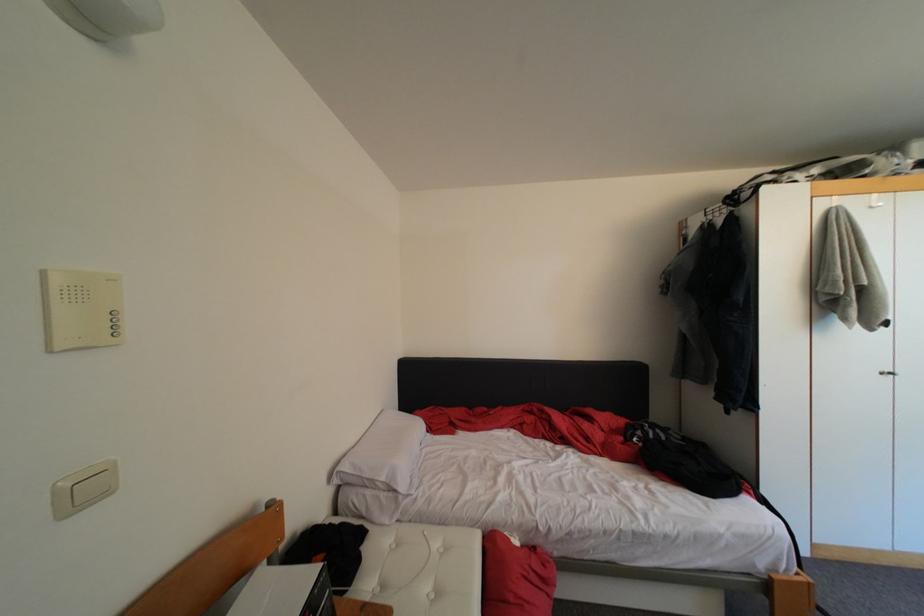
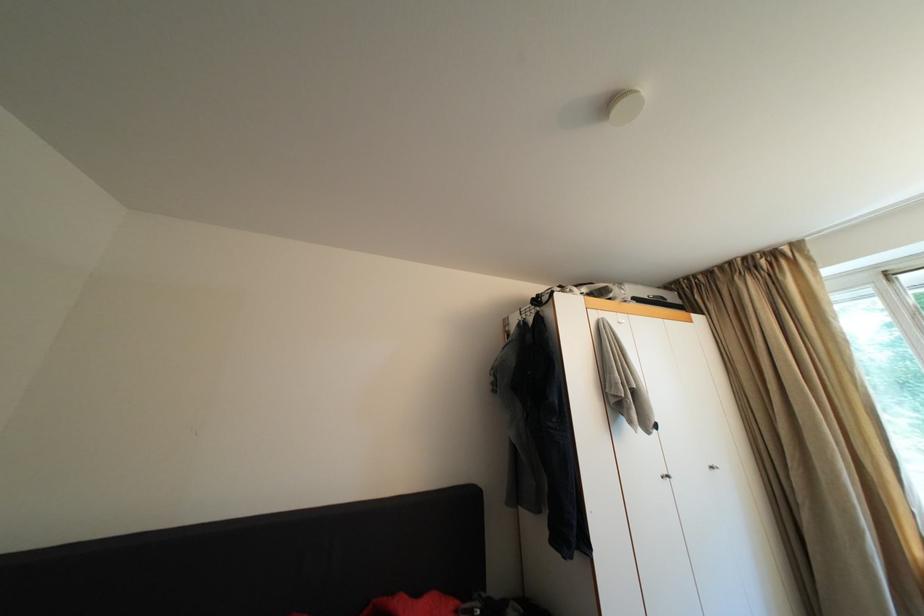
Consider the image. How did the camera likely rotate?

The rotation direction of the camera is right-up.